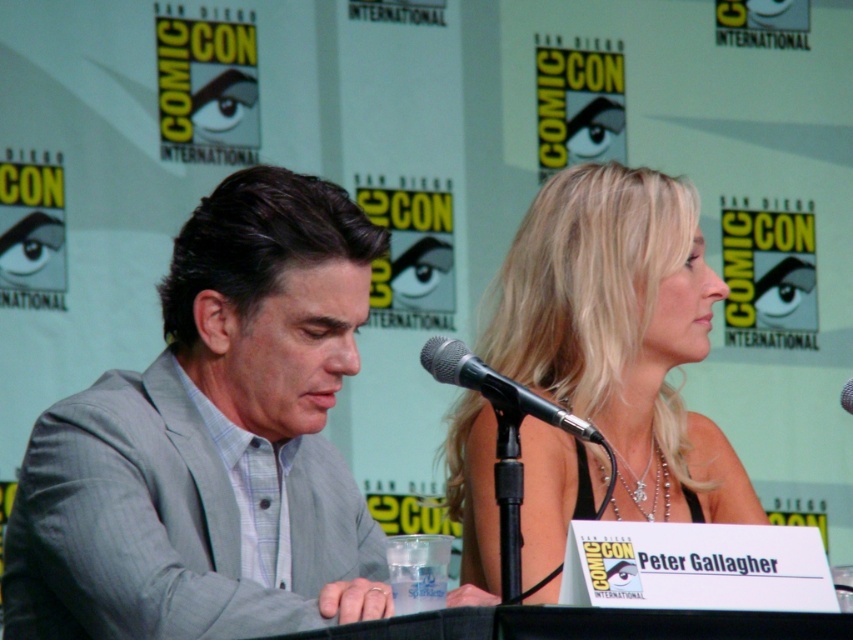
Does gray pinstripe suit at left appear on the left side of blonde hair at center?

Yes, gray pinstripe suit at left is to the left of blonde hair at center.

Is point (152, 547) in front of point (575, 186)?

Yes, point (152, 547) is in front of point (575, 186).

Locate an element on the screen. gray pinstripe suit at left is located at coordinates (212, 444).

The height and width of the screenshot is (640, 853). In order to click on gray pinstripe suit at left in this screenshot , I will do `click(212, 444)`.

Between point (700, 339) and point (485, 385), which one is positioned in front?

Positioned in front is point (485, 385).

Is point (601, 205) more distant than point (567, 424)?

Yes, it is behind point (567, 424).

This screenshot has height=640, width=853. Describe the element at coordinates (621, 333) in the screenshot. I see `blonde hair at center` at that location.

Image resolution: width=853 pixels, height=640 pixels. I want to click on blonde hair at center, so click(x=621, y=333).

Is point (236, 422) more distant than point (434, 364)?

Yes, it is.

Is gray pinstripe suit at left to the right of black metallic microphone at center from the viewer's perspective?

In fact, gray pinstripe suit at left is to the left of black metallic microphone at center.

Locate an element on the screen. gray pinstripe suit at left is located at coordinates (212, 444).

What are the coordinates of `gray pinstripe suit at left` in the screenshot? It's located at (212, 444).